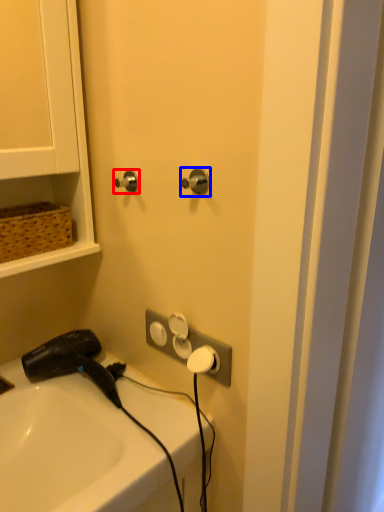
Question: Which point is further to the camera, door handle (highlighted by a red box) or door handle (highlighted by a blue box)?

Choices:
 (A) door handle
 (B) door handle

Answer: (A)